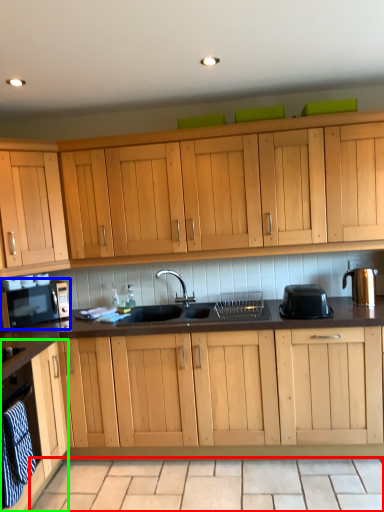
Question: Which object is positioned farthest from tile (highlighted by a red box)? Select from home appliance (highlighted by a blue box) and cabinetry (highlighted by a green box).

Choices:
 (A) home appliance
 (B) cabinetry

Answer: (A)